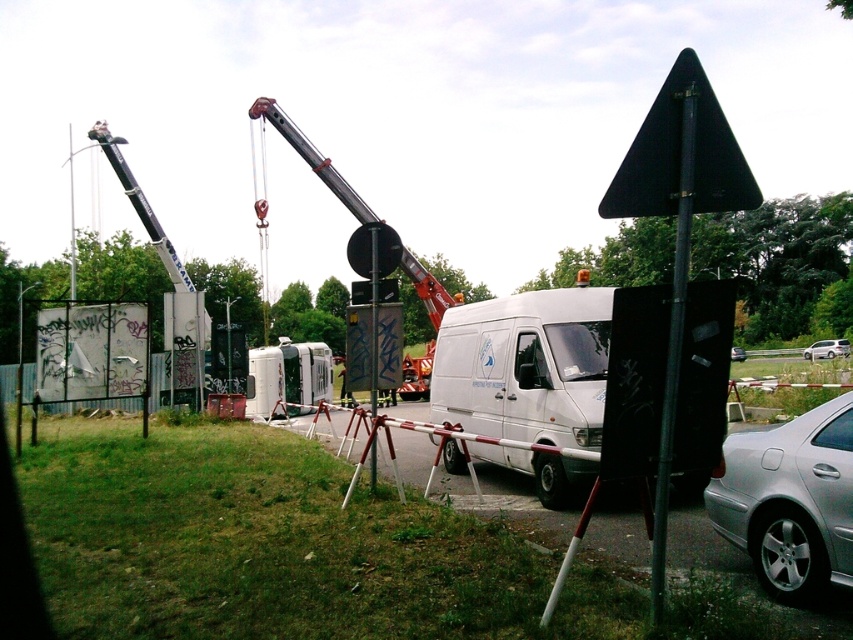
Between point (744, 525) and point (659, 115), which one is positioned in front?

Point (659, 115) is more forward.

Is point (769, 582) positioned before point (735, 166)?

That is False.

The image size is (853, 640). I want to click on silver metallic car at lower right, so click(790, 500).

Is point (437, 307) closer to camera compared to point (828, 339)?

Yes, point (437, 307) is in front of point (828, 339).

Which of these two, metallic silver crane at center or silver metallic car at right, stands taller?

metallic silver crane at center

Locate an element on the screen. The width and height of the screenshot is (853, 640). metallic silver crane at center is located at coordinates (312, 157).

Does silver metallic car at lower right have a larger size compared to black metal pole at center right?

Indeed, silver metallic car at lower right has a larger size compared to black metal pole at center right.

Is the position of silver metallic car at lower right less distant than that of black metal pole at center right?

No.

You are a GUI agent. You are given a task and a screenshot of the screen. Output one action in this format:
    pyautogui.click(x=<x>, y=<y>)
    Task: Click on the silver metallic car at lower right
    The image size is (853, 640).
    Given the screenshot: What is the action you would take?
    pyautogui.click(x=790, y=500)

Locate an element on the screen. This screenshot has width=853, height=640. silver metallic car at lower right is located at coordinates (x=790, y=500).